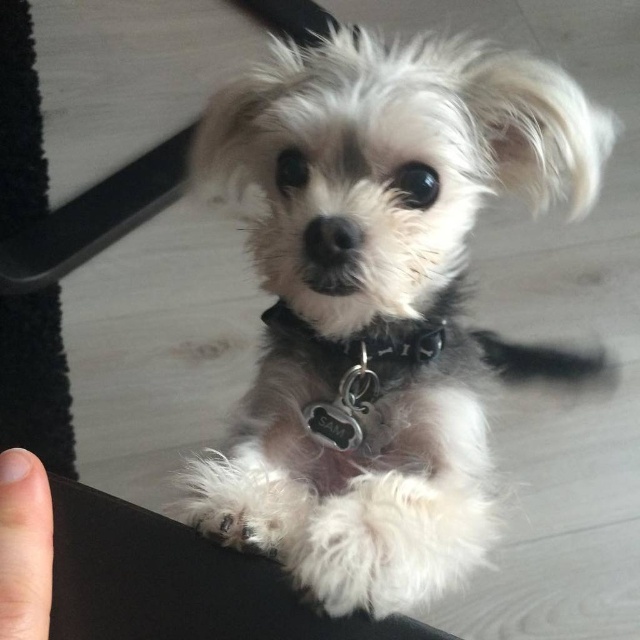
Who is lower down, white fluffy dog at center or smooth skin finger at lower left?

smooth skin finger at lower left

Which of these two, white fluffy dog at center or smooth skin finger at lower left, stands shorter?

With less height is smooth skin finger at lower left.

Which is in front, point (273, 93) or point (28, 611)?

Positioned in front is point (28, 611).

Locate an element on the screen. white fluffy dog at center is located at coordinates (380, 300).

Between point (337, 582) and point (300, 337), which one is positioned in front?

Point (337, 582) is more forward.

Can you confirm if white fluffy dog at center is positioned above black leather collar at center?

Incorrect, white fluffy dog at center is not positioned above black leather collar at center.

Which is behind, point (324, 120) or point (305, 333)?

Positioned behind is point (305, 333).

The height and width of the screenshot is (640, 640). What are the coordinates of `white fluffy dog at center` in the screenshot? It's located at (380, 300).

Which is more to the right, smooth skin finger at lower left or black leather collar at center?

Positioned to the right is black leather collar at center.

Can you confirm if smooth skin finger at lower left is bigger than black leather collar at center?

Incorrect, smooth skin finger at lower left is not larger than black leather collar at center.

Does point (45, 483) lie in front of point (275, 320)?

Yes.

You are a GUI agent. You are given a task and a screenshot of the screen. Output one action in this format:
    pyautogui.click(x=<x>, y=<y>)
    Task: Click on the smooth skin finger at lower left
    
    Given the screenshot: What is the action you would take?
    pos(24,547)